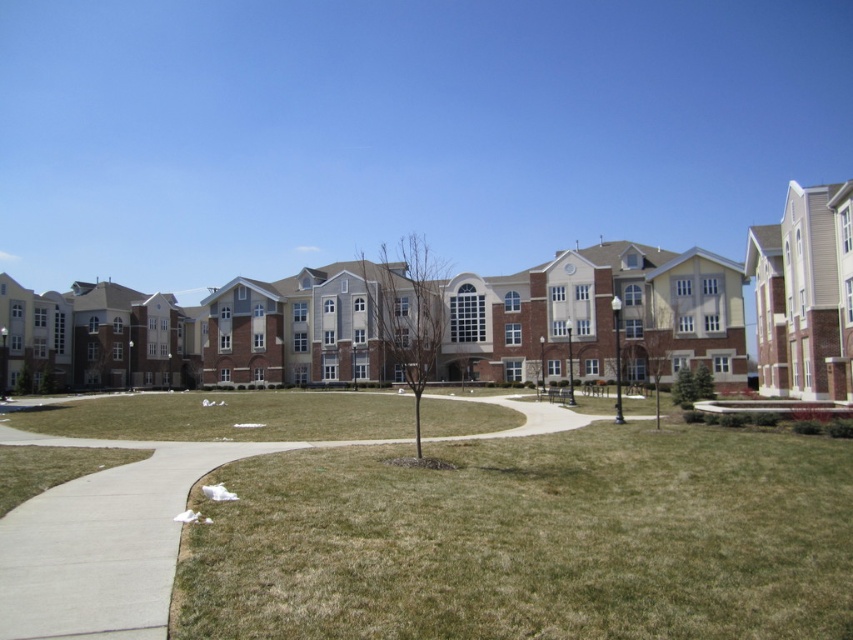
Is green grass at lower center to the right of green grass at center from the viewer's perspective?

Indeed, green grass at lower center is positioned on the right side of green grass at center.

The image size is (853, 640). What do you see at coordinates (531, 540) in the screenshot?
I see `green grass at lower center` at bounding box center [531, 540].

Measure the distance between green grass at lower center and camera.

A distance of 6.26 meters exists between green grass at lower center and camera.

The width and height of the screenshot is (853, 640). I want to click on green grass at lower center, so click(531, 540).